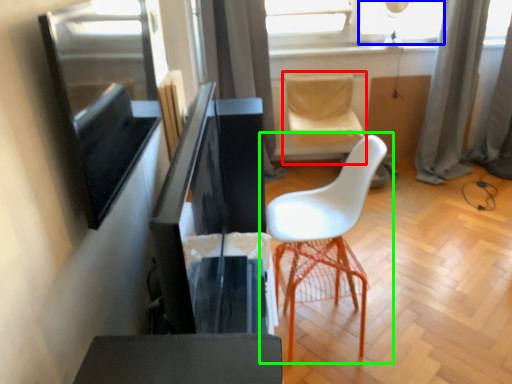
Question: Which object is the farthest from swivel chair (highlighted by a red box)? Choose among these: window (highlighted by a blue box) or chair (highlighted by a green box).

Choices:
 (A) window
 (B) chair

Answer: (B)